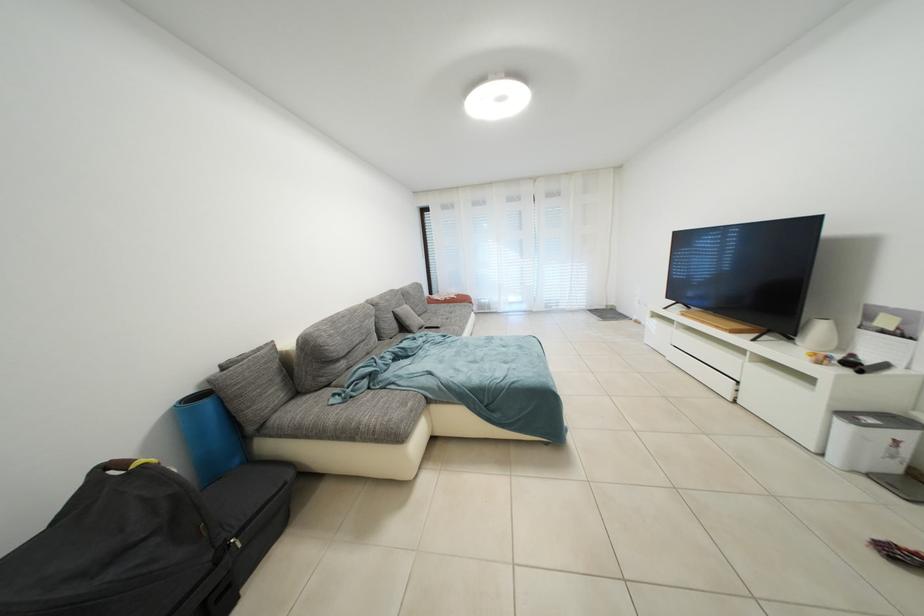
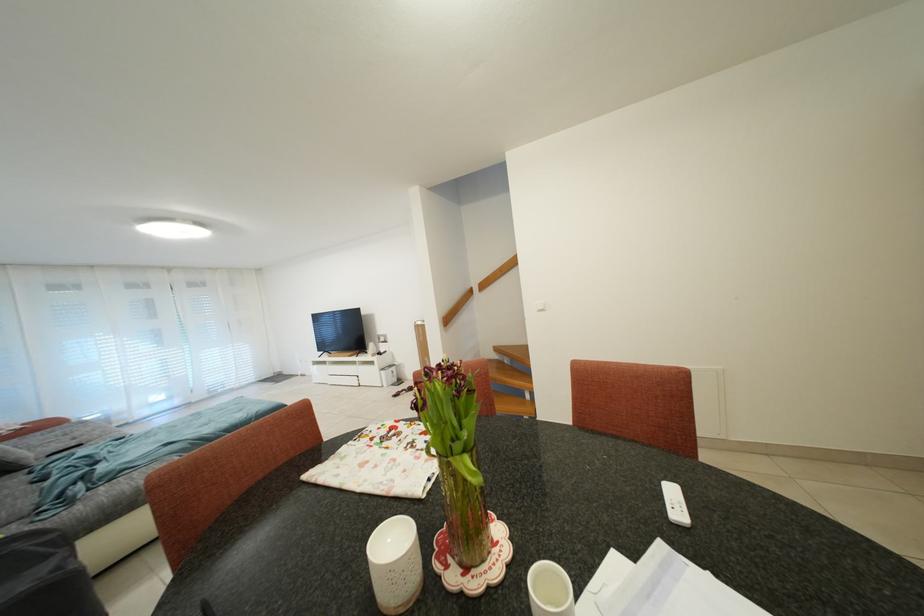
Find the pixel in the second image that matches the point at 417,326 in the first image.

(19, 462)